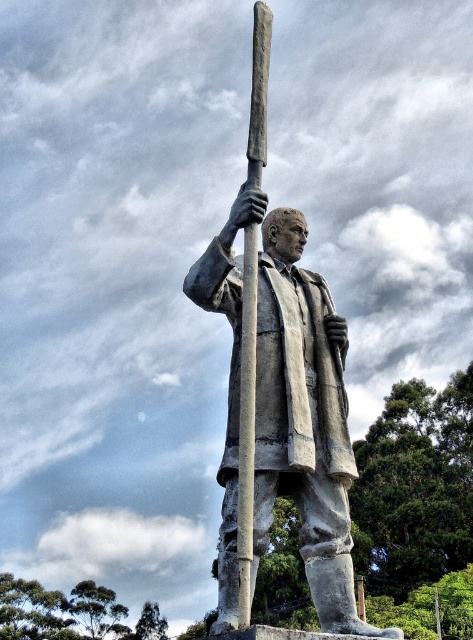
You are a city planner evaluating the placement of the bronze statue at center and the gray stone pole at center in a public square. Considering their heights, which object would likely cast a longer shadow during midday when the sun is directly overhead?

The bronze statue at center has a greater height compared to the gray stone pole at center, so it would cast a longer shadow during midday when the sun is directly overhead.

You are standing in front of a statue of a man holding a staff. There is a point at coordinates (280, 392). Which object does this point correspond to?

The point at coordinates (280, 392) corresponds to the bronze statue at center.

You are an art conservator assessing the statue and pole for preservation. Based on their sizes, which object would require a larger protective covering? Please refer to the bronze statue at center and the gray stone pole at center in your answer.

The bronze statue at center is bigger than the gray stone pole at center, so the bronze statue at center would require a larger protective covering.